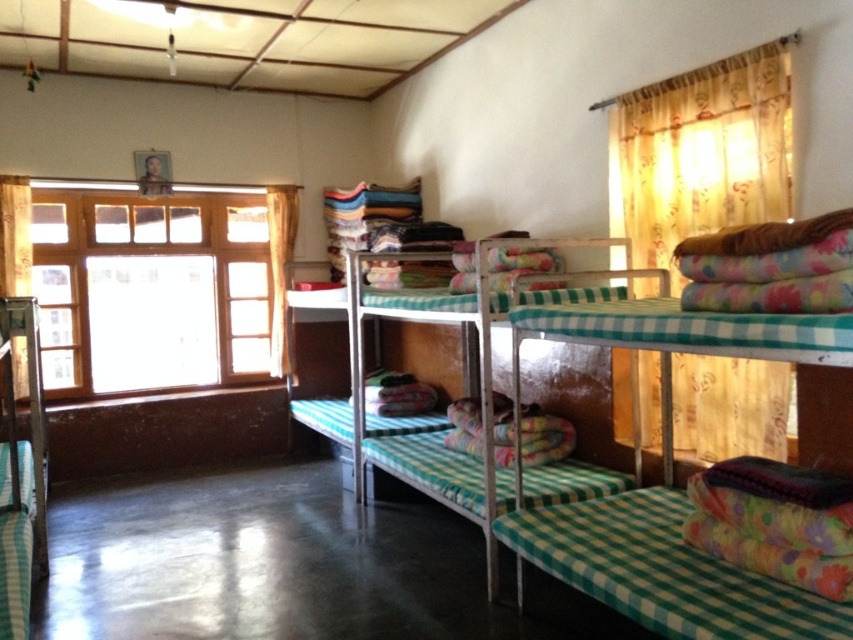
You are a student trying to find your bunk bed in the dormitory. You see the green checkered bunk bed at center and the yellow fabric curtain at left. Which object is closer to the floor?

The green checkered bunk bed at center is closer to the floor because it is below the yellow fabric curtain at left.

You are a maintenance worker needing to replace a curtain. You are standing in the dormitory room and see the wooden window at left and the yellow fabric curtain at left. How far apart are they?

The distance between wooden window at left and yellow fabric curtain at left is 27.53 inches.